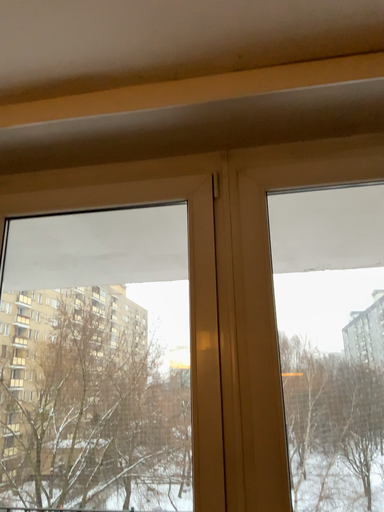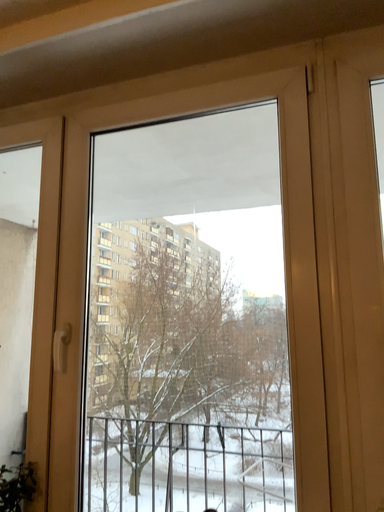
Question: How did the camera likely rotate when shooting the video?

Choices:
 (A) rotated downward
 (B) rotated upward

Answer: (A)